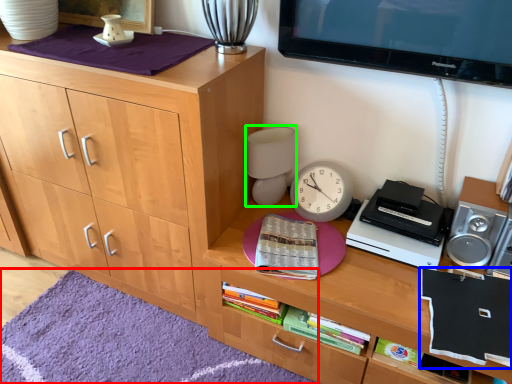
Question: Which is farther away from mat (highlighted by a red box)? book (highlighted by a blue box) or table lamp (highlighted by a green box)?

Choices:
 (A) book
 (B) table lamp

Answer: (A)